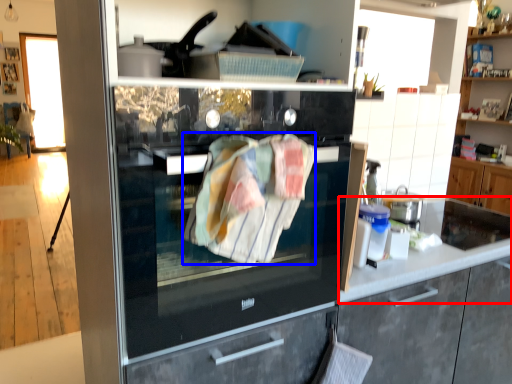
Question: Which of the following is the closest to the observer, countertop (highlighted by a red box) or blanket (highlighted by a blue box)?

Choices:
 (A) countertop
 (B) blanket

Answer: (B)